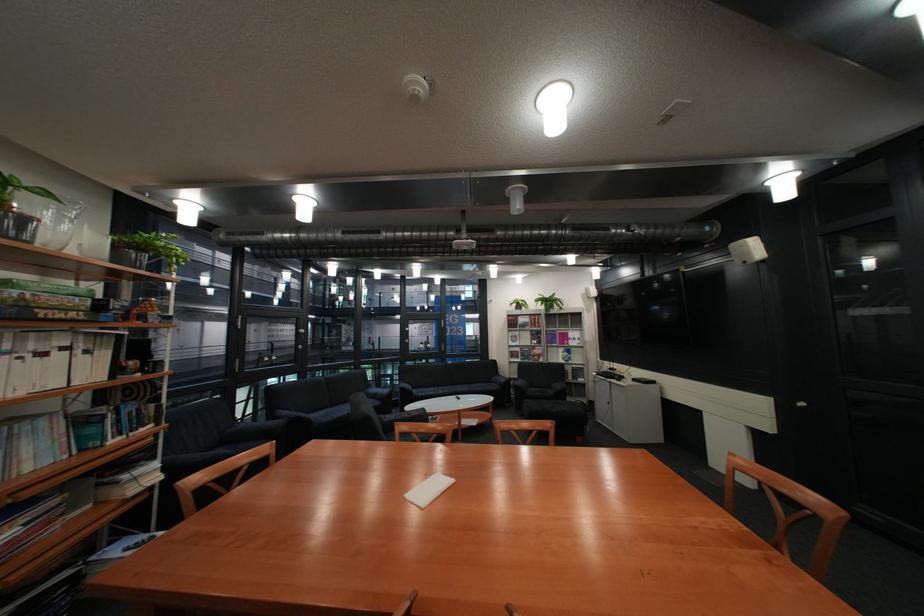
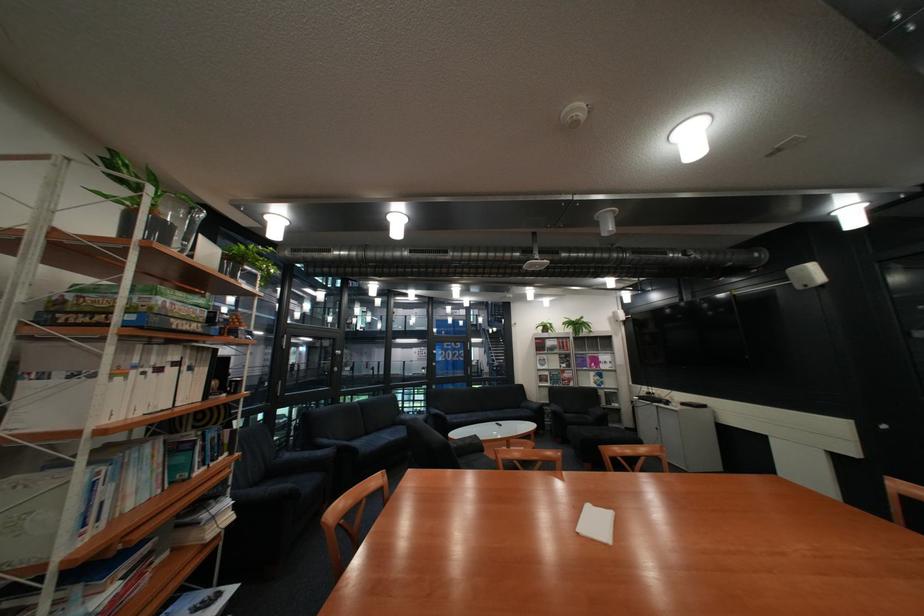
The point at [171,464] is marked in the first image. Where is the corresponding point in the second image?

(241, 501)